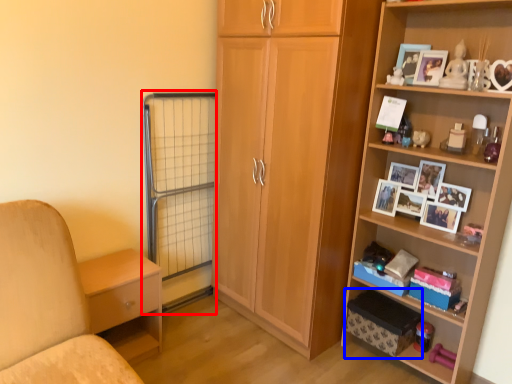
Question: Which of the following is the farthest to the observer, screen door (highlighted by a red box) or storage box (highlighted by a blue box)?

Choices:
 (A) screen door
 (B) storage box

Answer: (A)